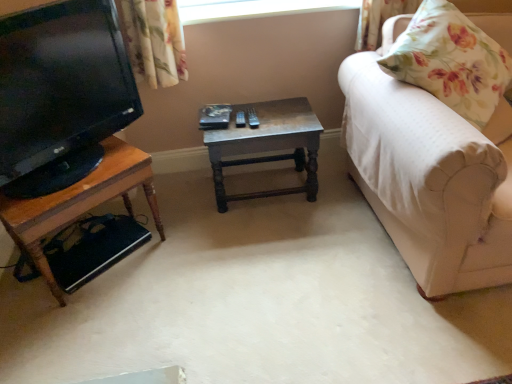
Image resolution: width=512 pixels, height=384 pixels. What are the coordinates of `free space above wooden table at center, acting as the first table starting from the right (from a real-world perspective)` in the screenshot? It's located at (247, 119).